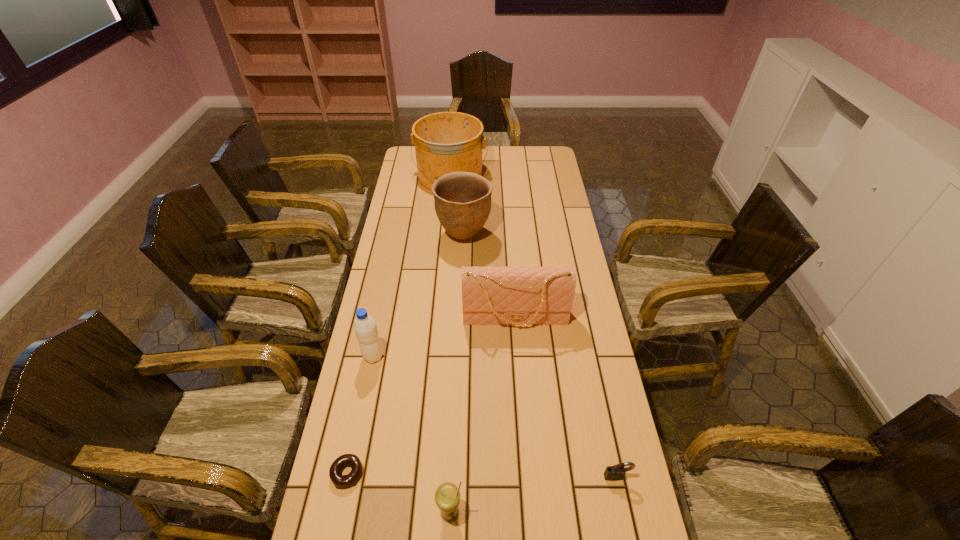
Where is `vacant area between the straw for drinking and the farthest object`? vacant area between the straw for drinking and the farthest object is located at coordinates (450, 345).

Identify the location of free space between the sixth nearest object and the doughnut. (405, 354).

At what (x,y) coordinates should I click in order to perform the action: click on vacant area that lies between the straw for drinking and the fifth nearest object. Please return your answer as a coordinate pair (x, y). Looking at the image, I should click on (483, 416).

This screenshot has width=960, height=540. I want to click on vacant area that lies between the sixth nearest object and the doughnut, so (x=405, y=354).

The image size is (960, 540). I want to click on free space between the shortest object and the fifth nearest object, so click(431, 396).

This screenshot has height=540, width=960. Find the location of `free point between the sixth tallest object and the water bottle`. free point between the sixth tallest object and the water bottle is located at coordinates (495, 416).

You are a GUI agent. You are given a task and a screenshot of the screen. Output one action in this format:
    pyautogui.click(x=<x>, y=<y>)
    Task: Click on the object identified as the fifth closest to the sixth nearest object
    
    Given the screenshot: What is the action you would take?
    pyautogui.click(x=616, y=472)

Identify which object is the fourth nearest to the doughnut. Please provide its 2D coordinates. Your answer should be formatted as a tuple, i.e. [(x, y)], where the tuple contains the x and y coordinates of a point satisfying the conditions above.

[(616, 472)]